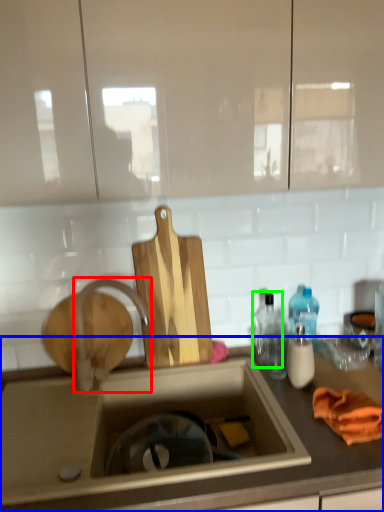
Question: Which object is positioned farthest from tap (highlighted by a red box)? Select from countertop (highlighted by a blue box) and bottle (highlighted by a green box).

Choices:
 (A) countertop
 (B) bottle

Answer: (B)